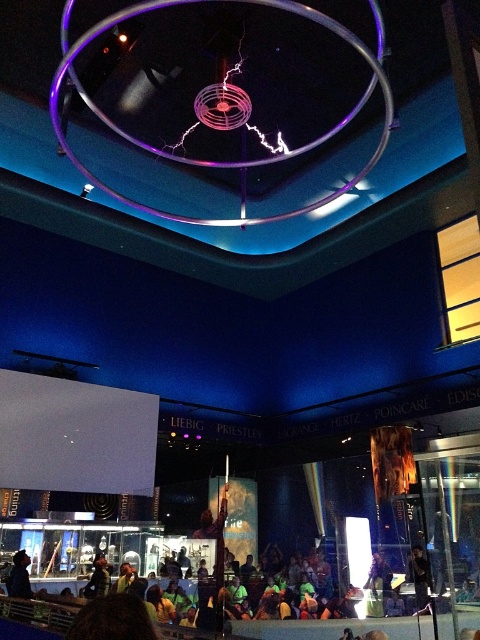
You are a security guard in the museum and notice two objects in the image that need to be inspected. The matte black jacket at lower left and the black fabric at lower center are both potential hazards. If you start at the entrance, which is near the Tesla coil display, which object should you check first based on their proximity to the entrance?

The matte black jacket at lower left is closer to the entrance near the Tesla coil display than the black fabric at lower center, so you should check the matte black jacket at lower left first.

Looking at this image, you are a security guard in the science museum and you see the matte black jacket at lower left and the black fabric at lower center on the floor. Which object takes up more space on the floor?

The matte black jacket at lower left is larger in size than the black fabric at lower center, so it takes up more space on the floor.